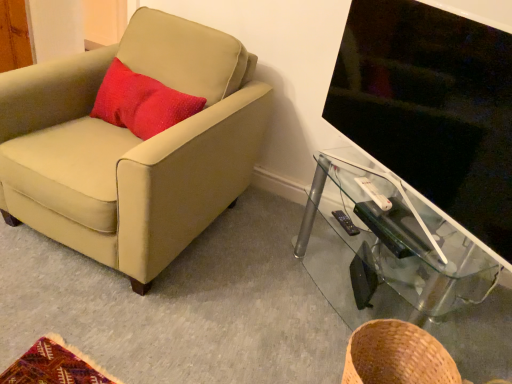
Question: Should I look upward or downward to see brown woven basket at lower right?

Choices:
 (A) down
 (B) up

Answer: (A)

Question: Considering the relative positions of black plastic remote control at lower right, which is the 2th remote control from front to back, and white plastic remote control at right, marked as the second remote control in a back-to-front arrangement, in the image provided, is black plastic remote control at lower right, which is the 2th remote control from front to back, to the left of white plastic remote control at right, marked as the second remote control in a back-to-front arrangement, from the viewer's perspective?

Choices:
 (A) yes
 (B) no

Answer: (A)

Question: Could white plastic remote control at right, which ranks as the first remote control in front-to-back order, be considered to be inside black plastic remote control at lower right, which is the first remote control in bottom-to-top order?

Choices:
 (A) no
 (B) yes

Answer: (A)

Question: Is white plastic remote control at right, positioned as the first remote control in top-to-bottom order, at the back of black plastic remote control at lower right, positioned as the second remote control in top-to-bottom order?

Choices:
 (A) yes
 (B) no

Answer: (B)

Question: Is black plastic remote control at lower right, positioned as the second remote control in top-to-bottom order, facing towards white plastic remote control at right, the second remote control ordered from the bottom?

Choices:
 (A) no
 (B) yes

Answer: (A)

Question: From the image's perspective, is black plastic remote control at lower right, arranged as the 1th remote control when viewed from the back, under white plastic remote control at right, the second remote control ordered from the bottom?

Choices:
 (A) yes
 (B) no

Answer: (A)

Question: Does black plastic remote control at lower right, positioned as the second remote control in top-to-bottom order, come behind white plastic remote control at right, positioned as the first remote control in top-to-bottom order?

Choices:
 (A) no
 (B) yes

Answer: (B)

Question: From a real-world perspective, is black plastic remote control at lower right, arranged as the 1th remote control when viewed from the back, located beneath transparent glass tv stand at right?

Choices:
 (A) no
 (B) yes

Answer: (A)

Question: Considering the relative sizes of black plastic remote control at lower right, positioned as the second remote control in top-to-bottom order, and transparent glass tv stand at right in the image provided, is black plastic remote control at lower right, positioned as the second remote control in top-to-bottom order, wider than transparent glass tv stand at right?

Choices:
 (A) no
 (B) yes

Answer: (A)

Question: Is black plastic remote control at lower right, which is the first remote control in bottom-to-top order, to the right of transparent glass tv stand at right from the viewer's perspective?

Choices:
 (A) yes
 (B) no

Answer: (B)

Question: Does black plastic remote control at lower right, arranged as the 1th remote control when viewed from the back, have a larger size compared to transparent glass tv stand at right?

Choices:
 (A) no
 (B) yes

Answer: (A)

Question: Is black plastic remote control at lower right, which is the 2th remote control from front to back, not within transparent glass tv stand at right?

Choices:
 (A) yes
 (B) no

Answer: (B)

Question: Is the depth of black plastic remote control at lower right, which is the 2th remote control from front to back, less than that of transparent glass tv stand at right?

Choices:
 (A) yes
 (B) no

Answer: (B)

Question: Is brown woven basket at lower right touching white plastic remote control at right, the second remote control ordered from the bottom?

Choices:
 (A) no
 (B) yes

Answer: (A)